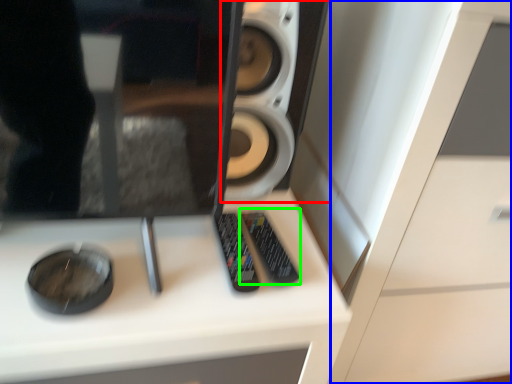
Question: Which object is positioned closest to speaker (highlighted by a red box)? Select from dresser (highlighted by a blue box) and control (highlighted by a green box).

Choices:
 (A) dresser
 (B) control

Answer: (B)